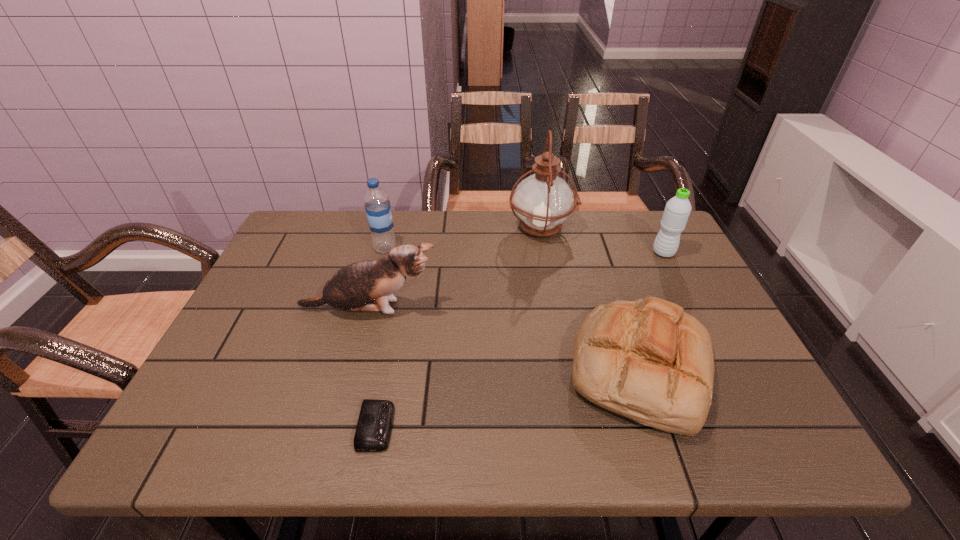
I want to click on free space that is in between the fifth tallest object and the tallest object, so click(x=591, y=299).

Where is `unoccupied area between the bread and the shortest object`? unoccupied area between the bread and the shortest object is located at coordinates (509, 398).

I want to click on free space between the fifth tallest object and the tallest object, so click(591, 299).

Locate an element on the screen. The image size is (960, 540). vacant region between the second shortest object and the tallest object is located at coordinates (591, 299).

Locate an element on the screen. object that is the closest to the right water bottle is located at coordinates (543, 201).

Find the location of a particular element. The width and height of the screenshot is (960, 540). object that is the fourth closest one to the second shortest object is located at coordinates (374, 426).

You are a GUI agent. You are given a task and a screenshot of the screen. Output one action in this format:
    pyautogui.click(x=<x>, y=<y>)
    Task: Click on the free location that satisfies the following two spatial constraints: 1. on the front side of the oil lamp; 2. on the display of the shortest object
    
    Given the screenshot: What is the action you would take?
    pyautogui.click(x=578, y=427)

You are a GUI agent. You are given a task and a screenshot of the screen. Output one action in this format:
    pyautogui.click(x=<x>, y=<y>)
    Task: Click on the free space in the image that satisfies the following two spatial constraints: 1. on the label of the fifth tallest object; 2. on the left side of the left water bottle
    The image size is (960, 540).
    Given the screenshot: What is the action you would take?
    pyautogui.click(x=353, y=369)

You are a GUI agent. You are given a task and a screenshot of the screen. Output one action in this format:
    pyautogui.click(x=<x>, y=<y>)
    Task: Click on the vacant area in the image that satisfies the following two spatial constraints: 1. on the label of the left water bottle; 2. on the right side of the fifth tallest object
    
    Given the screenshot: What is the action you would take?
    pyautogui.click(x=353, y=369)

Locate an element on the screen. The width and height of the screenshot is (960, 540). vacant point that satisfies the following two spatial constraints: 1. on the front side of the bread; 2. on the left side of the oil lamp is located at coordinates (567, 369).